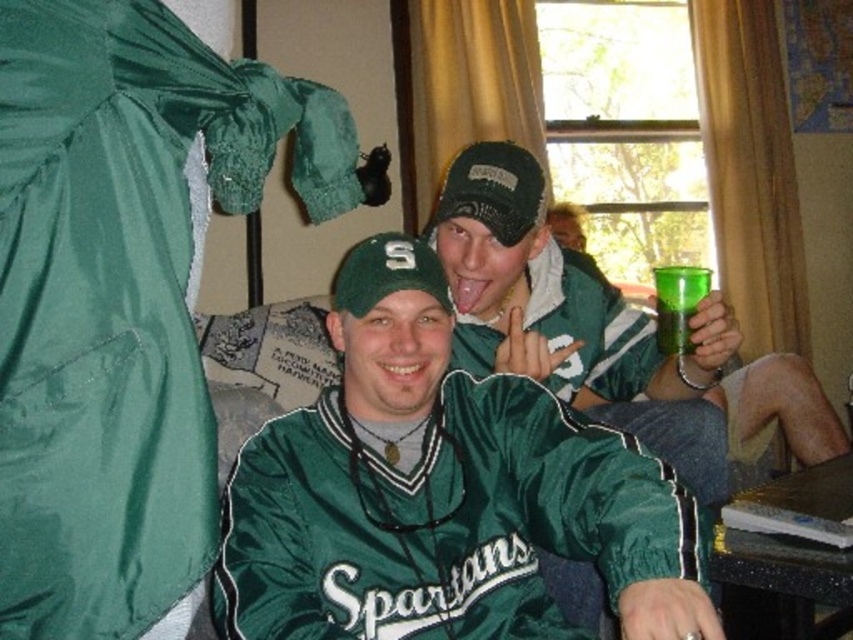
In the scene shown: You are a photographer setting up a shoot in the scene. You need to place a small prop between the satin green dress at left and the green satin baseball uniform at center. Based on their heights, which object should the prop be placed closer to?

The satin green dress at left is taller than the green satin baseball uniform at center, so the prop should be placed closer to the green satin baseball uniform at center to ensure stability and balance.